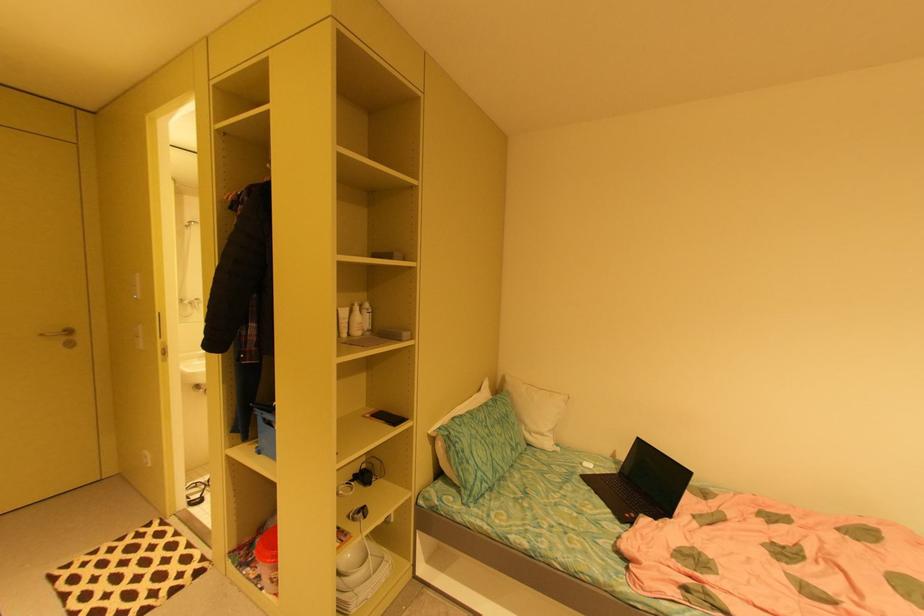
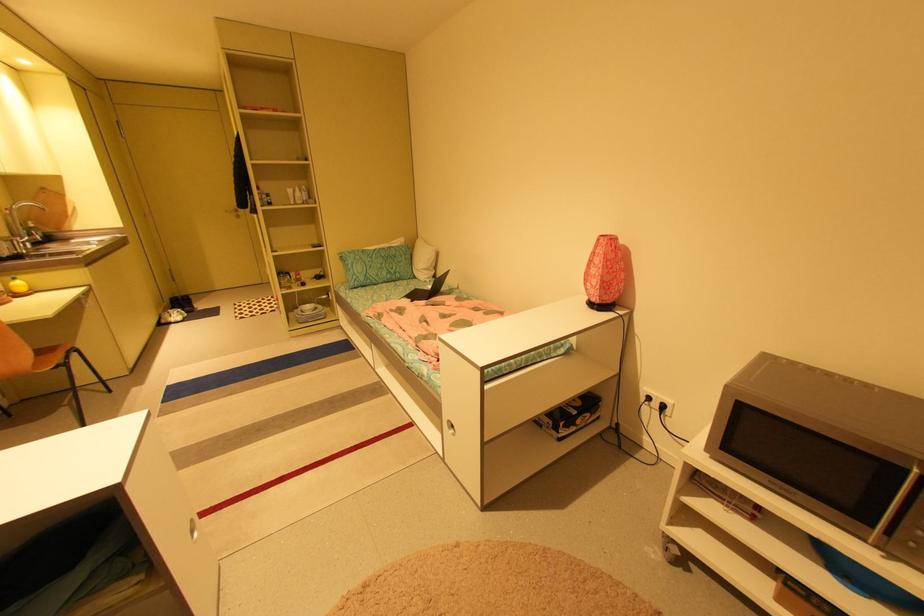
Find the pixel in the second image that matches point 49,334 in the first image.

(232, 211)